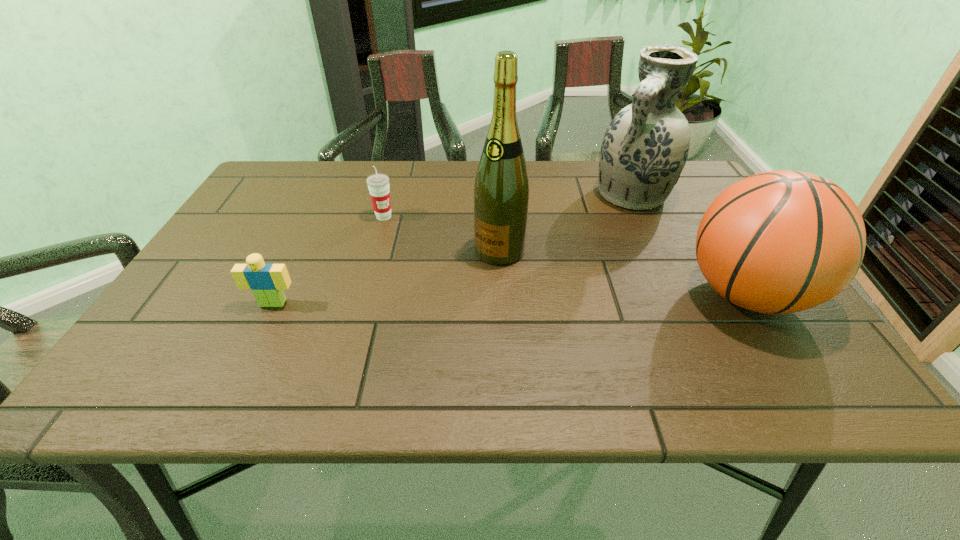
Where is `empty location between the basketball and the third object from right to left`? Image resolution: width=960 pixels, height=540 pixels. empty location between the basketball and the third object from right to left is located at coordinates (623, 273).

At what (x,y) coordinates should I click in order to perform the action: click on vacant space that is in between the third object from right to left and the fourth object from right to left. Please return your answer as a coordinate pair (x, y). This screenshot has height=540, width=960. Looking at the image, I should click on (442, 234).

Image resolution: width=960 pixels, height=540 pixels. I want to click on empty space that is in between the second shortest object and the third tallest object, so click(564, 255).

Identify the location of vacant area that lies between the wine bottle and the fourth tallest object. The image size is (960, 540). (442, 234).

You are a GUI agent. You are given a task and a screenshot of the screen. Output one action in this format:
    pyautogui.click(x=<x>, y=<y>)
    Task: Click on the vacant region between the fourth object from right to left and the basketball
    This screenshot has height=540, width=960.
    Given the screenshot: What is the action you would take?
    pyautogui.click(x=564, y=255)

Where is `vacant space that is in between the shortest object and the wine bottle`? The width and height of the screenshot is (960, 540). vacant space that is in between the shortest object and the wine bottle is located at coordinates (386, 277).

This screenshot has width=960, height=540. Find the location of `vacant space in between the third object from right to left and the basketball`. vacant space in between the third object from right to left and the basketball is located at coordinates (623, 273).

Locate an element on the screen. empty space that is in between the Lego and the wine bottle is located at coordinates (386, 277).

Choose which object is the second nearest neighbor to the basketball. Please provide its 2D coordinates. Your answer should be formatted as a tuple, i.e. [(x, y)], where the tuple contains the x and y coordinates of a point satisfying the conditions above.

[(501, 191)]

Locate which object ranks second in proximity to the Lego. Please provide its 2D coordinates. Your answer should be formatted as a tuple, i.e. [(x, y)], where the tuple contains the x and y coordinates of a point satisfying the conditions above.

[(501, 191)]